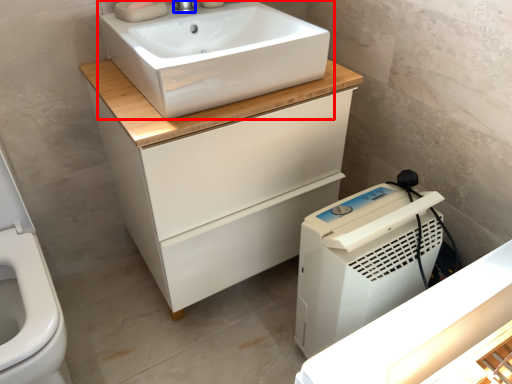
Question: Which point is further to the camera, sink (highlighted by a red box) or tap (highlighted by a blue box)?

Choices:
 (A) sink
 (B) tap

Answer: (B)